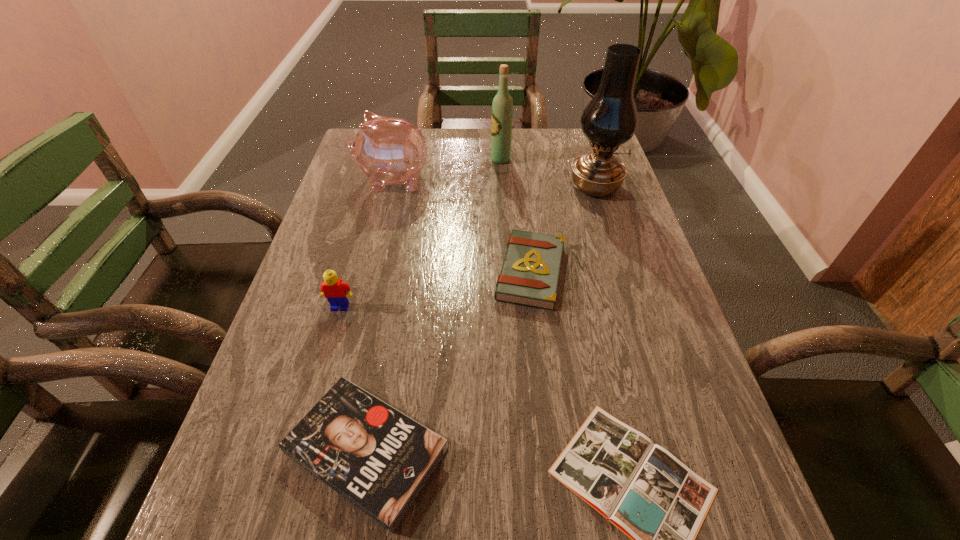
Find the location of a particular element. The image size is (960, 540). free space between the piggy bank and the leftmost book is located at coordinates (380, 315).

Find the location of a particular element. This screenshot has height=540, width=960. object that is the second closest one to the oil lamp is located at coordinates (502, 106).

Where is `object that can be found as the closest to the shortest object`? object that can be found as the closest to the shortest object is located at coordinates (379, 459).

Identify which book is located as the third nearest to the tallest object. Please provide its 2D coordinates. Your answer should be formatted as a tuple, i.e. [(x, y)], where the tuple contains the x and y coordinates of a point satisfying the conditions above.

[(379, 459)]

Locate which book ranks third in proximity to the wine bottle. Please provide its 2D coordinates. Your answer should be formatted as a tuple, i.e. [(x, y)], where the tuple contains the x and y coordinates of a point satisfying the conditions above.

[(646, 492)]

The width and height of the screenshot is (960, 540). Find the location of `free spot that satisfies the following two spatial constraints: 1. on the front-facing side of the leftmost book; 2. on the left side of the fourth shortest object`. free spot that satisfies the following two spatial constraints: 1. on the front-facing side of the leftmost book; 2. on the left side of the fourth shortest object is located at coordinates (299, 451).

Locate an element on the screen. free space that satisfies the following two spatial constraints: 1. on the front facing side of the third tallest object; 2. on the front-facing side of the Lego is located at coordinates (363, 307).

Find the location of a particular element. This screenshot has width=960, height=540. vacant space that satisfies the following two spatial constraints: 1. on the front facing side of the piggy bank; 2. on the back side of the farthest book is located at coordinates (371, 272).

What are the coordinates of `vacant space that satisfies the following two spatial constraints: 1. on the front facing side of the third tallest object; 2. on the front-facing side of the fourth tallest object` in the screenshot? It's located at (363, 307).

The height and width of the screenshot is (540, 960). What are the coordinates of `vacant space that satisfies the following two spatial constraints: 1. on the front facing side of the leftmost book; 2. on the right side of the third tallest object` in the screenshot? It's located at 327,451.